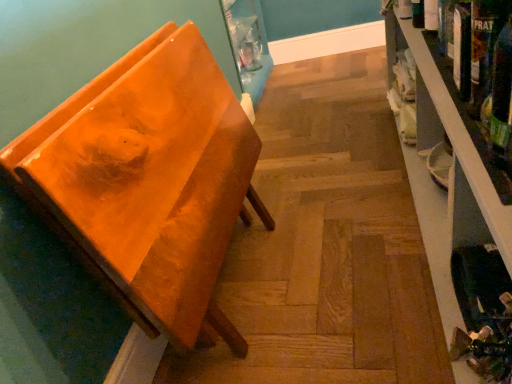
Measure the distance between point (476, 222) and camera.

Point (476, 222) is 3.49 feet away from camera.

The height and width of the screenshot is (384, 512). In order to click on wooden shelf at right in this screenshot , I will do `click(458, 207)`.

Is wooden shelf at right far away from orange glossy chair at left?

No, wooden shelf at right is not far from orange glossy chair at left.

From the image's perspective, is wooden shelf at right over orange glossy chair at left?

Yes.

Looking at this image, is wooden shelf at right oriented away from orange glossy chair at left?

Yes.

Which of these two, wooden shelf at right or orange glossy chair at left, is smaller?

orange glossy chair at left.

Is wooden shelf at right to the left or to the right of green glass bottle at right in the image?

Clearly, wooden shelf at right is on the right of green glass bottle at right in the image.

Which object is closer to the camera taking this photo, wooden shelf at right or green glass bottle at right?

wooden shelf at right is closer to the camera.

From a real-world perspective, is wooden shelf at right physically above green glass bottle at right?

Incorrect, from a real-world perspective, wooden shelf at right is lower than green glass bottle at right.

Considering the sizes of orange glossy chair at left and green glass bottle at right in the image, is orange glossy chair at left wider or thinner than green glass bottle at right?

orange glossy chair at left is wider than green glass bottle at right.

From the image's perspective, between orange glossy chair at left and green glass bottle at right, which one is located above?

green glass bottle at right, from the image's perspective.

Considering the relative sizes of orange glossy chair at left and green glass bottle at right in the image provided, is orange glossy chair at left bigger than green glass bottle at right?

Yes, orange glossy chair at left is bigger than green glass bottle at right.

This screenshot has width=512, height=384. I want to click on furniture on the left of green glass bottle at right, so click(148, 182).

From the image's perspective, between green glass bottle at right and orange glossy chair at left, who is located below?

orange glossy chair at left.

In the scene shown: Is green glass bottle at right positioned beyond the bounds of orange glossy chair at left?

Indeed, green glass bottle at right is completely outside orange glossy chair at left.

Find the location of `beer bottle above the orange glossy chair at left (from a real-world perspective)`. beer bottle above the orange glossy chair at left (from a real-world perspective) is located at coordinates (501, 94).

What's the angular difference between green glass bottle at right and orange glossy chair at left's facing directions?

The angle between the facing direction of green glass bottle at right and the facing direction of orange glossy chair at left is 179 degrees.

Is point (148, 297) closer to camera compared to point (498, 193)?

No, it is behind (498, 193).

Is orange glossy chair at left facing away from wooden shelf at right?

orange glossy chair at left is not turned away from wooden shelf at right.

Is orange glossy chair at left surrounding wooden shelf at right?

That's incorrect, wooden shelf at right is not inside orange glossy chair at left.

From the picture: Between orange glossy chair at left and wooden shelf at right, which one has larger size?

Bigger between the two is wooden shelf at right.

Locate an element on the screen. shelf that appears above the green glass bottle at right (from the image's perspective) is located at coordinates (458, 207).

Can you confirm if green glass bottle at right is taller than wooden shelf at right?

No, green glass bottle at right is not taller than wooden shelf at right.

From a real-world perspective, which object stands above the other?

green glass bottle at right.

From the image's perspective, is green glass bottle at right located beneath wooden shelf at right?

Indeed, from the image's perspective, green glass bottle at right is shown beneath wooden shelf at right.

Where is `shelf located on the right of orange glossy chair at left`? The height and width of the screenshot is (384, 512). shelf located on the right of orange glossy chair at left is located at coordinates (458, 207).

Identify the location of beer bottle above the wooden shelf at right (from a real-world perspective). (501, 94).

Considering their positions, is green glass bottle at right positioned closer to wooden shelf at right than orange glossy chair at left?

orange glossy chair at left is positioned closer to the anchor wooden shelf at right.

From the image, which object appears to be farther from green glass bottle at right, wooden shelf at right or orange glossy chair at left?

wooden shelf at right is positioned further to the anchor green glass bottle at right.

Which object lies nearer to the anchor point orange glossy chair at left, wooden shelf at right or green glass bottle at right?

wooden shelf at right is positioned closer to the anchor orange glossy chair at left.

Which object lies further to the anchor point green glass bottle at right, orange glossy chair at left or wooden shelf at right?

Among the two, wooden shelf at right is located further to green glass bottle at right.

Which object lies nearer to the anchor point wooden shelf at right, orange glossy chair at left or green glass bottle at right?

Based on the image, orange glossy chair at left appears to be nearer to wooden shelf at right.

From the image, which object appears to be farther from orange glossy chair at left, green glass bottle at right or wooden shelf at right?

Among the two, green glass bottle at right is located further to orange glossy chair at left.

Where is `beer bottle between orange glossy chair at left and wooden shelf at right from left to right`? beer bottle between orange glossy chair at left and wooden shelf at right from left to right is located at coordinates (501, 94).